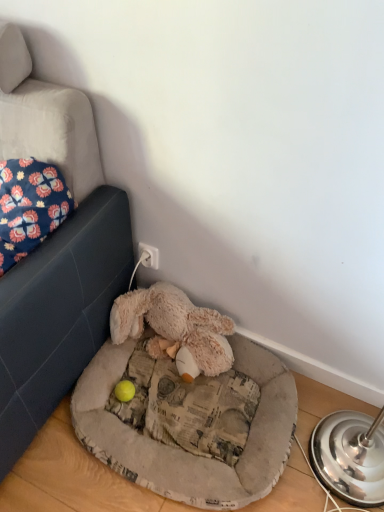
Question: Which direction should I rotate to look at fluffy beige stuffed animal at lower center?

Choices:
 (A) left
 (B) right

Answer: (A)

Question: Considering the relative sizes of fluffy beige stuffed animal at lower center and fluffy beige dog bed at lower center in the image provided, is fluffy beige stuffed animal at lower center taller than fluffy beige dog bed at lower center?

Choices:
 (A) no
 (B) yes

Answer: (B)

Question: From a real-world perspective, is fluffy beige stuffed animal at lower center physically above fluffy beige dog bed at lower center?

Choices:
 (A) no
 (B) yes

Answer: (B)

Question: From the image's perspective, is fluffy beige stuffed animal at lower center located above fluffy beige dog bed at lower center?

Choices:
 (A) no
 (B) yes

Answer: (B)

Question: Are fluffy beige stuffed animal at lower center and fluffy beige dog bed at lower center located far from each other?

Choices:
 (A) yes
 (B) no

Answer: (B)

Question: From the image's perspective, does fluffy beige stuffed animal at lower center appear lower than fluffy beige dog bed at lower center?

Choices:
 (A) no
 (B) yes

Answer: (A)

Question: Is fluffy beige stuffed animal at lower center looking in the opposite direction of fluffy beige dog bed at lower center?

Choices:
 (A) no
 (B) yes

Answer: (A)

Question: Is fluffy beige dog bed at lower center wider than fluffy beige stuffed animal at lower center?

Choices:
 (A) yes
 (B) no

Answer: (A)

Question: Is fluffy beige dog bed at lower center at the right side of fluffy beige stuffed animal at lower center?

Choices:
 (A) no
 (B) yes

Answer: (B)

Question: From a real-world perspective, is fluffy beige dog bed at lower center located beneath fluffy beige stuffed animal at lower center?

Choices:
 (A) no
 (B) yes

Answer: (B)

Question: Is fluffy beige dog bed at lower center not close to fluffy beige stuffed animal at lower center?

Choices:
 (A) no
 (B) yes

Answer: (A)

Question: Is fluffy beige dog bed at lower center aimed at fluffy beige stuffed animal at lower center?

Choices:
 (A) yes
 (B) no

Answer: (B)

Question: Is fluffy beige dog bed at lower center positioned before fluffy beige stuffed animal at lower center?

Choices:
 (A) no
 (B) yes

Answer: (B)

Question: Is the depth of floral fabric pillow at upper left less than that of fluffy beige dog bed at lower center?

Choices:
 (A) yes
 (B) no

Answer: (A)